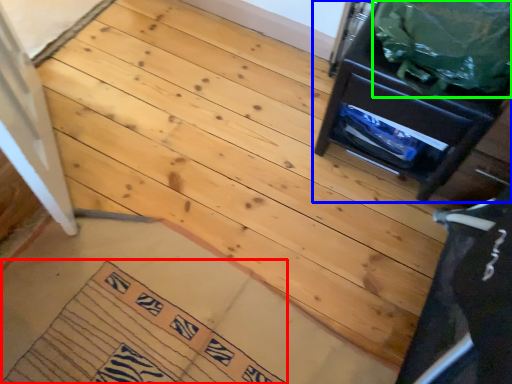
Question: Which is farther away from doormat (highlighted by a red box)? furniture (highlighted by a blue box) or garbage (highlighted by a green box)?

Choices:
 (A) furniture
 (B) garbage

Answer: (B)